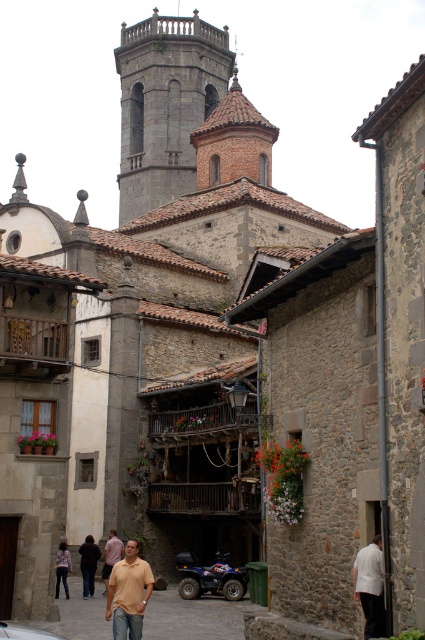
You are a tourist walking through the brown stone alley at center and you want to pass by the light brown leather jacket at lower center. Can you walk through the alley without touching the jacket?

The brown stone alley at center is wider than the light brown leather jacket at lower center, so yes, you can walk through the alley without touching the jacket.

You are a delivery person needing to park your white matte car at lower left close to the light brown leather jacket at lower center. Given that the parking space is 10 feet wide, will there be enough space between them?

The distance between the light brown leather jacket at lower center and the white matte car at lower left is 45.73 feet. Since the parking space is only 10 feet wide, there is insufficient space to park the white matte car at lower left near the light brown leather jacket at lower center.